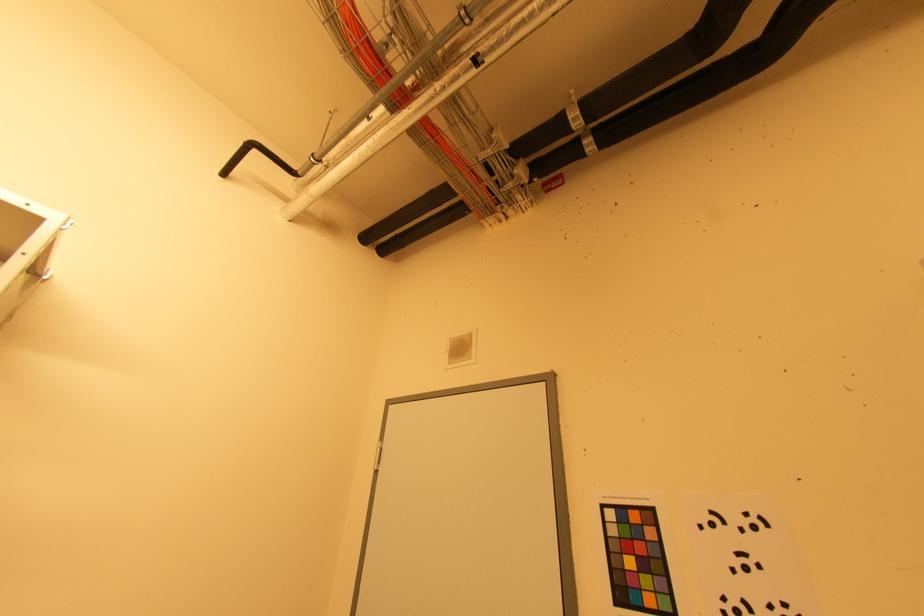
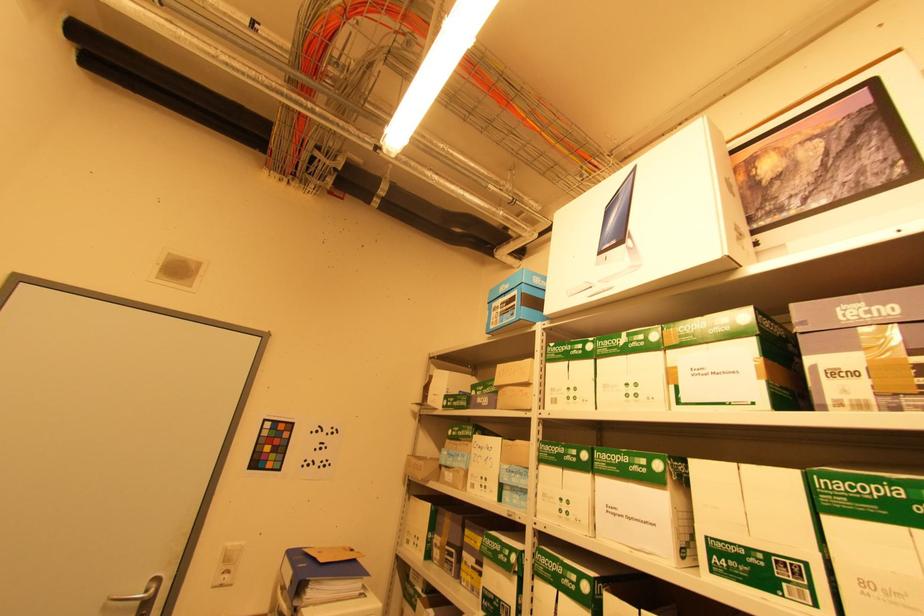
Question: The images are taken continuously from a first-person perspective. In which direction is your viewpoint rotating?

Choices:
 (A) Left
 (B) Right
 (C) Up
 (D) Down

Answer: (B)